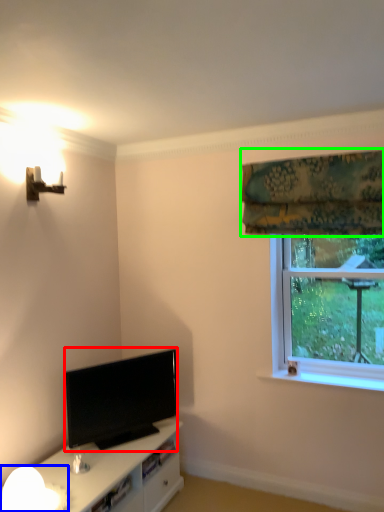
Question: Which object is the farthest from television (highlighted by a red box)? Choose among these: lamp (highlighted by a blue box) or curtain (highlighted by a green box).

Choices:
 (A) lamp
 (B) curtain

Answer: (B)